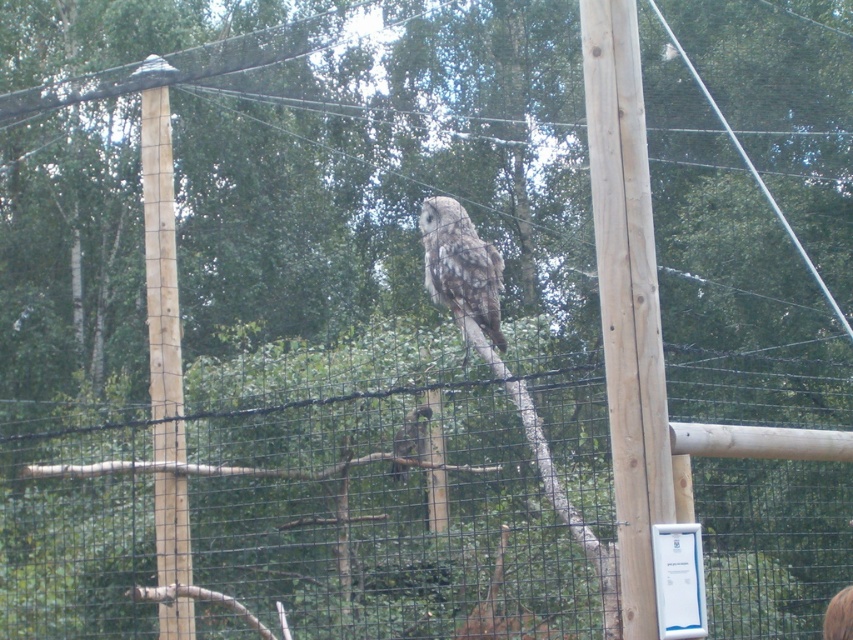
Question: Which point is farther to the camera?

Choices:
 (A) brown speckled owl at center
 (B) black mesh fence at center
 (C) speckled gray owl at center

Answer: (A)

Question: Can you confirm if black mesh fence at center is positioned below brown speckled owl at center?

Choices:
 (A) yes
 (B) no

Answer: (A)

Question: Which point is farther to the camera?

Choices:
 (A) natural wood telegraph pole at left
 (B) black mesh fence at center
 (C) natural wood telegraph pole at center
 (D) speckled gray owl at center

Answer: (A)

Question: Does speckled gray owl at center appear under brown speckled owl at center?

Choices:
 (A) yes
 (B) no

Answer: (B)

Question: Which of the following is the farthest from the observer?

Choices:
 (A) (442, 230)
 (B) (404, 448)

Answer: (B)

Question: In this image, where is natural wood telegraph pole at center located relative to natural wood telegraph pole at left?

Choices:
 (A) left
 (B) right

Answer: (B)